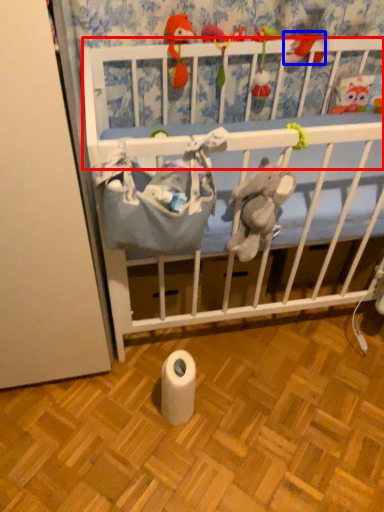
Question: Which of the following is the closest to the observer, infant bed (highlighted by a red box) or toy (highlighted by a blue box)?

Choices:
 (A) infant bed
 (B) toy

Answer: (A)